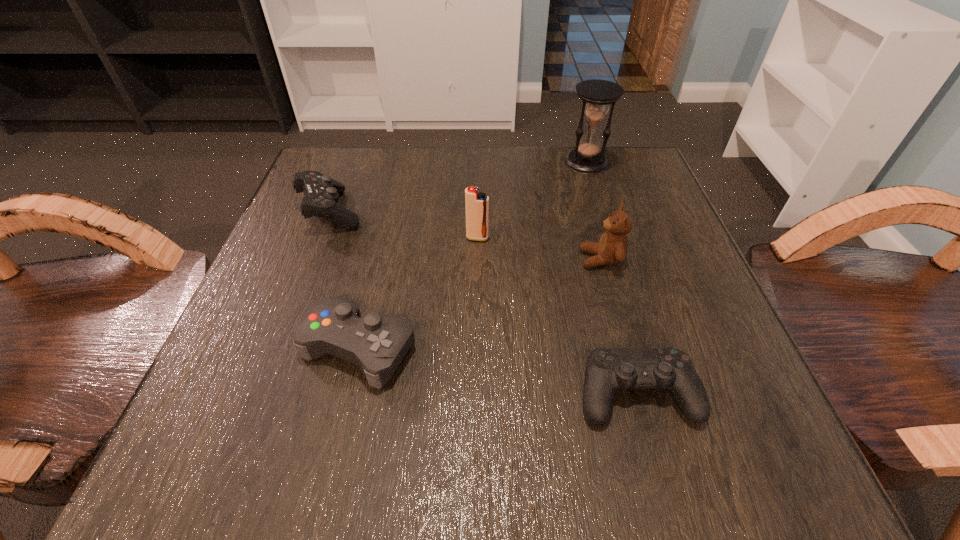
Where is `object that is at the far right corner`? object that is at the far right corner is located at coordinates (596, 95).

At what (x,y) coordinates should I click in order to perform the action: click on object that is at the near right corner. Please return your answer as a coordinate pair (x, y). The image size is (960, 540). Looking at the image, I should click on (607, 370).

This screenshot has width=960, height=540. In the image, there is a desktop. Find the location of `vacant space at the far edge`. vacant space at the far edge is located at coordinates [x=417, y=208].

Find the location of a particular element. The image size is (960, 540). vacant space at the left edge of the desktop is located at coordinates (276, 327).

You are a GUI agent. You are given a task and a screenshot of the screen. Output one action in this format:
    pyautogui.click(x=<x>, y=<y>)
    Task: Click on the vacant space at the right edge of the desktop
    
    Given the screenshot: What is the action you would take?
    pyautogui.click(x=655, y=271)

You are a GUI agent. You are given a task and a screenshot of the screen. Output one action in this format:
    pyautogui.click(x=<x>, y=<y>)
    Task: Click on the vacant space at the far left corner of the desktop
    The height and width of the screenshot is (540, 960).
    Given the screenshot: What is the action you would take?
    pyautogui.click(x=372, y=191)

You are a GUI agent. You are given a task and a screenshot of the screen. Output one action in this format:
    pyautogui.click(x=<x>, y=<y>)
    Task: Click on the free space at the far right corner of the desktop
    This screenshot has width=960, height=540.
    Given the screenshot: What is the action you would take?
    pyautogui.click(x=607, y=194)

Find the location of a particular element. The width and height of the screenshot is (960, 540). vacant area at the near right corner is located at coordinates coord(680,414).

The height and width of the screenshot is (540, 960). I want to click on free space between the teddy bear and the rightmost control, so click(x=619, y=326).

Where is `free space that is in between the farthest control and the tallest object`? This screenshot has height=540, width=960. free space that is in between the farthest control and the tallest object is located at coordinates (459, 187).